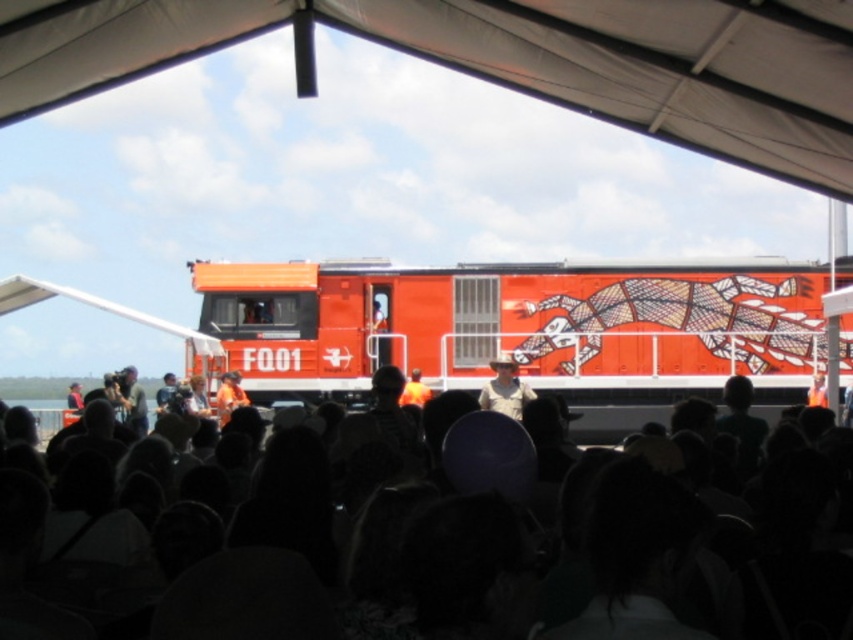
You are a photographer at the event and want to take a photo of the orange matte train at center and the orange fabric at center. Which object will appear larger in your photo?

The orange matte train at center will appear larger in the photo because it is closer to the viewer than the orange fabric at center.

You are standing at the center of the crowd and want to reach the orange fabric at center. Is the khaki fabric hat at center blocking your path?

The khaki fabric hat at center is 5.49 meters away from orange fabric at center, so it is not blocking your path since it is far away.